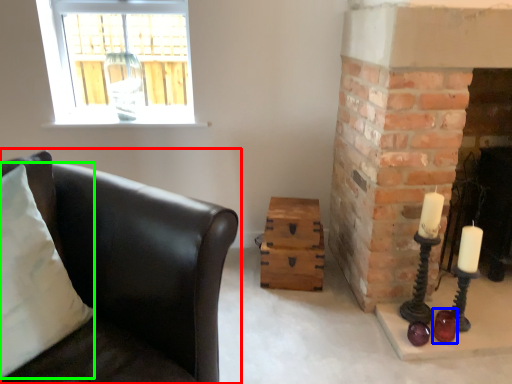
Question: Which object is positioned farthest from studio couch (highlighted by a red box)? Select from candle holder (highlighted by a blue box) and pillow (highlighted by a green box).

Choices:
 (A) candle holder
 (B) pillow

Answer: (A)